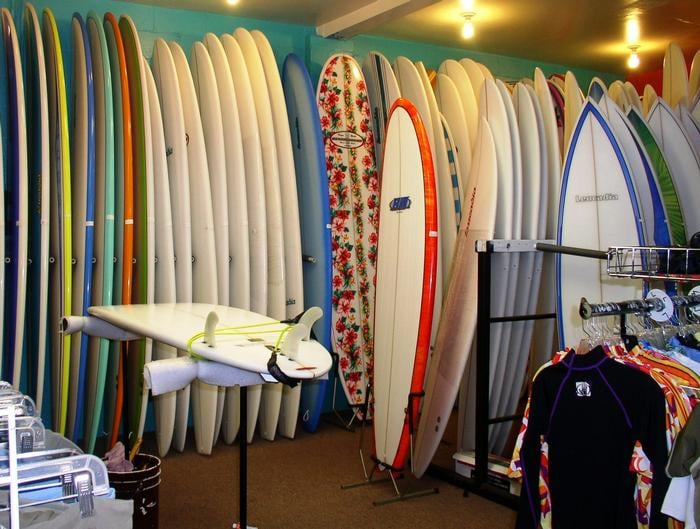
At what (x,y) coordinates should I click in order to perform the action: click on ceiling light. Please return your answer as a coordinate pair (x, y). The width and height of the screenshot is (700, 529). Looking at the image, I should click on (468, 26), (640, 45).